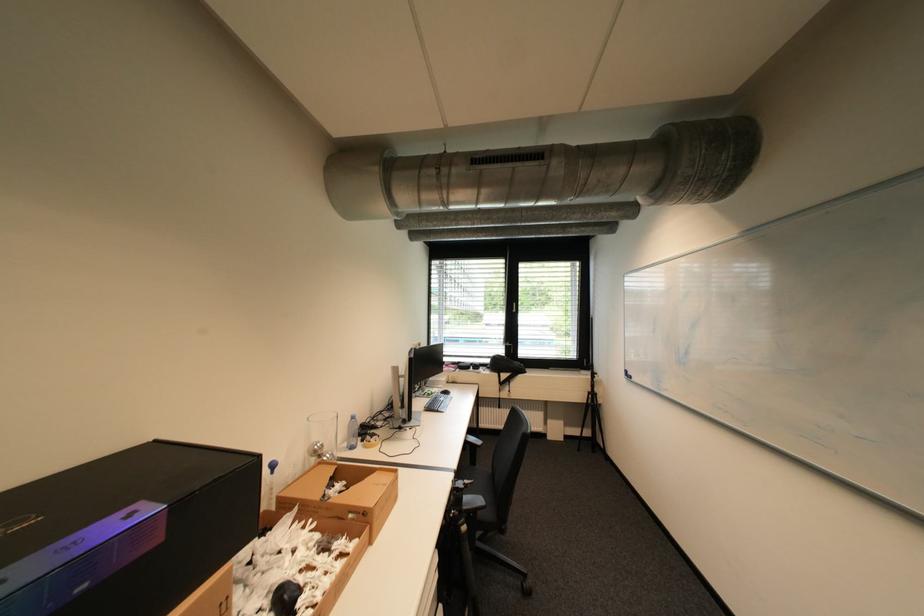
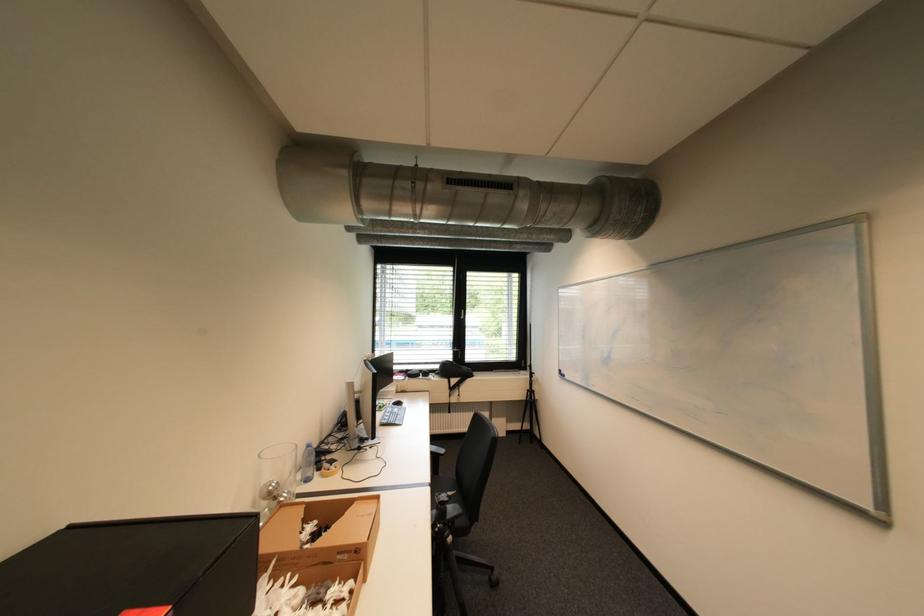
Where in the second image is the point corresponding to (x=480, y=515) from the first image?

(458, 525)